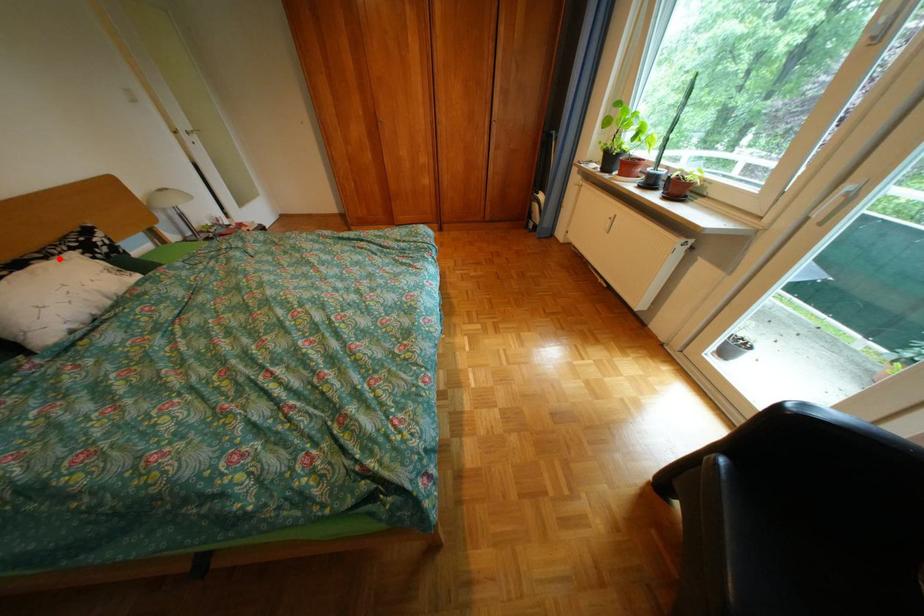
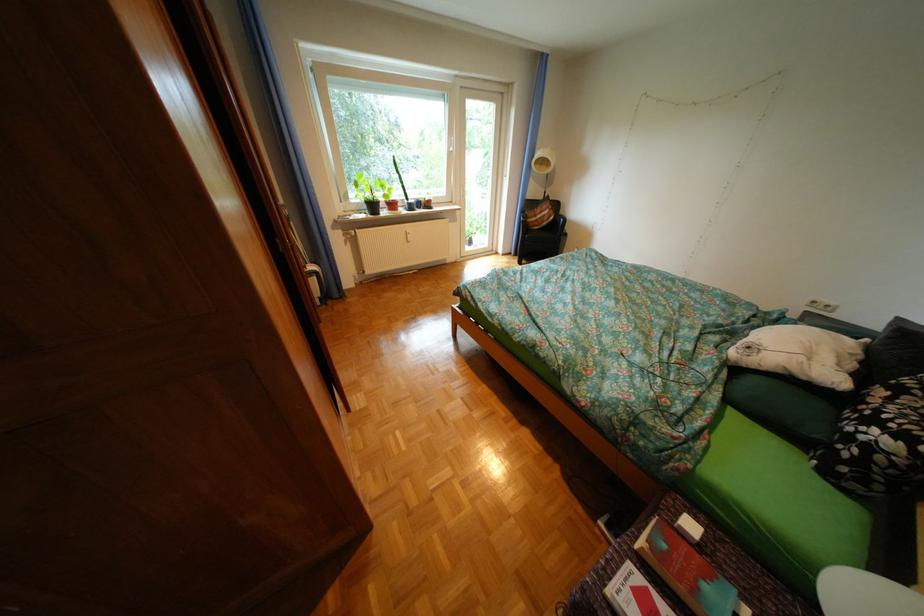
Where in the second image is the point corresponding to the highlighted location from the first image?

(904, 399)